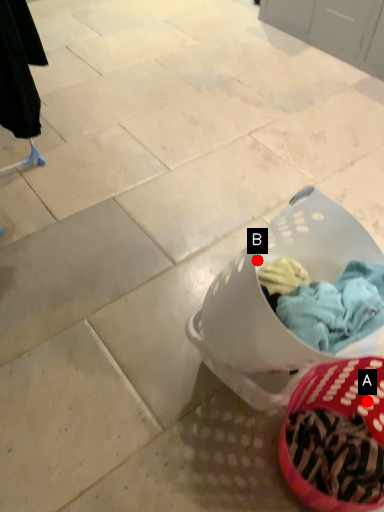
Question: Two points are circled on the image, labeled by A and B beside each circle. Which point appears farthest from the camera in this image?

Choices:
 (A) A is further
 (B) B is further

Answer: (B)